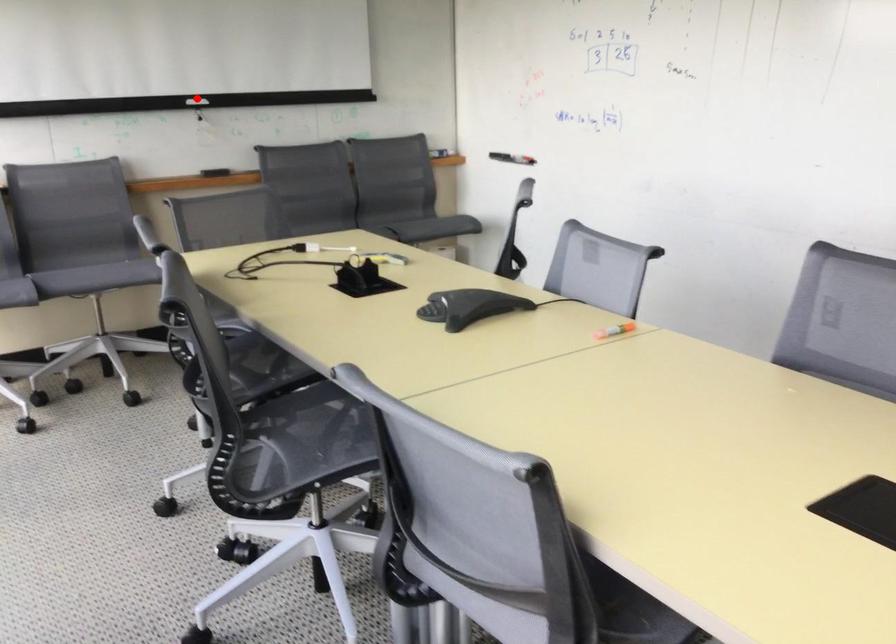
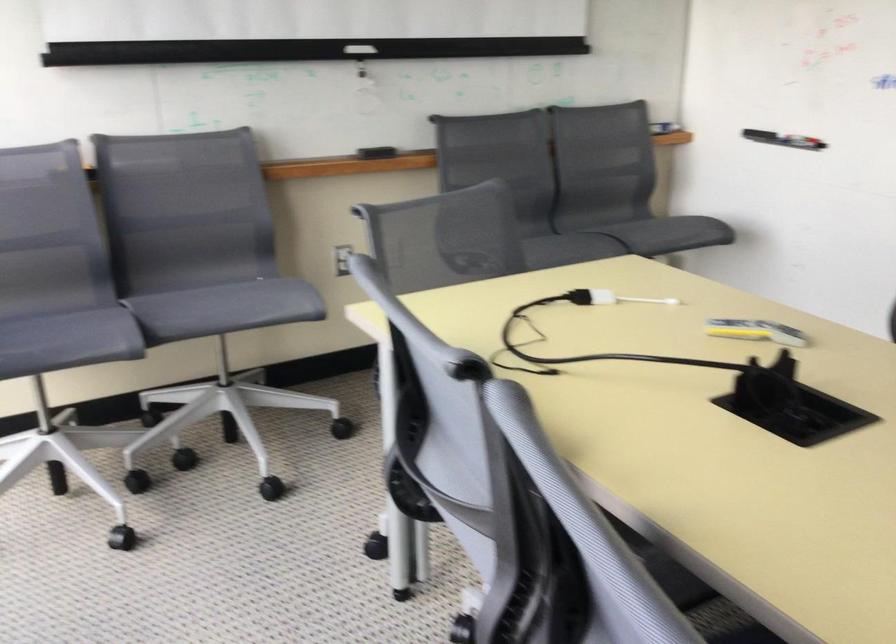
Find the pixel in the second image that matches the highlighted location in the first image.

(359, 49)